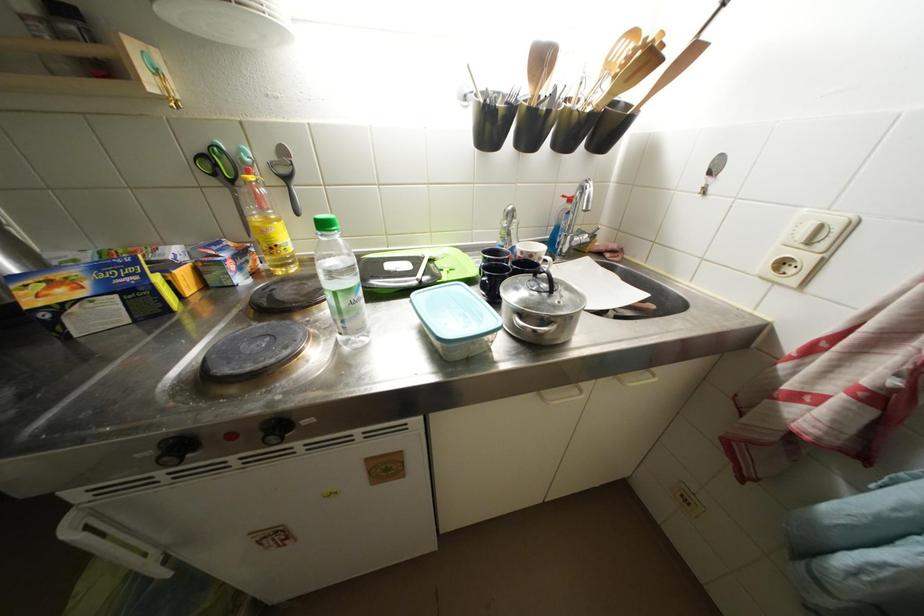
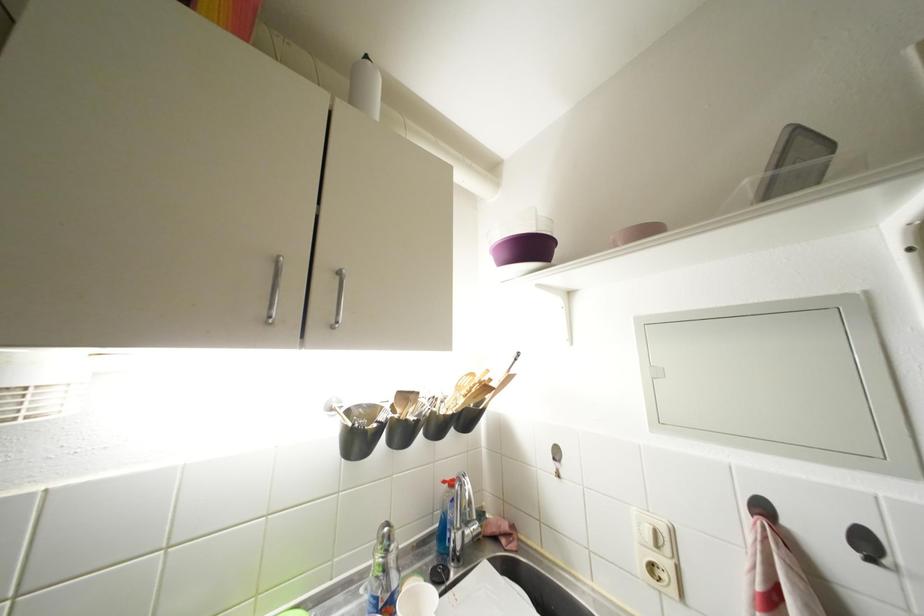
The point at (577, 204) is marked in the first image. Where is the corresponding point in the second image?

(457, 488)